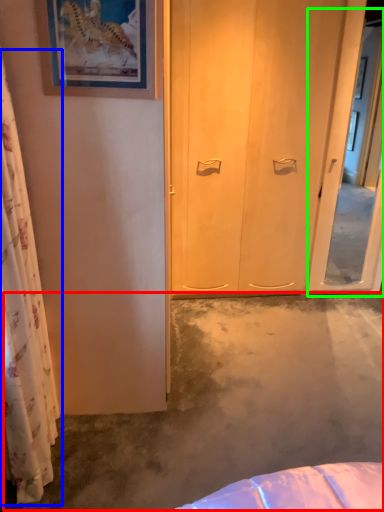
Question: Estimate the real-world distances between objects in this image. Which object is farther from concrete (highlighted by a red box), curtain (highlighted by a blue box) or screen door (highlighted by a green box)?

Choices:
 (A) curtain
 (B) screen door

Answer: (B)